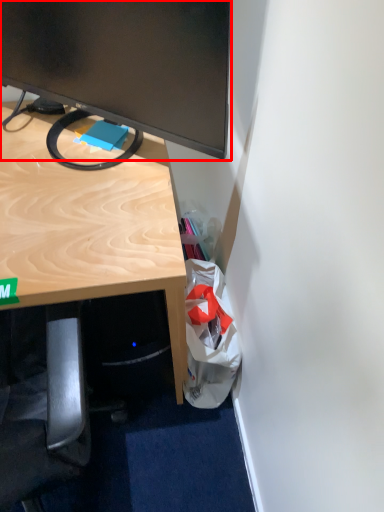
Question: From the image's perspective, where is television (annotated by the red box) located in relation to shopping bag in the image?

Choices:
 (A) below
 (B) above

Answer: (B)